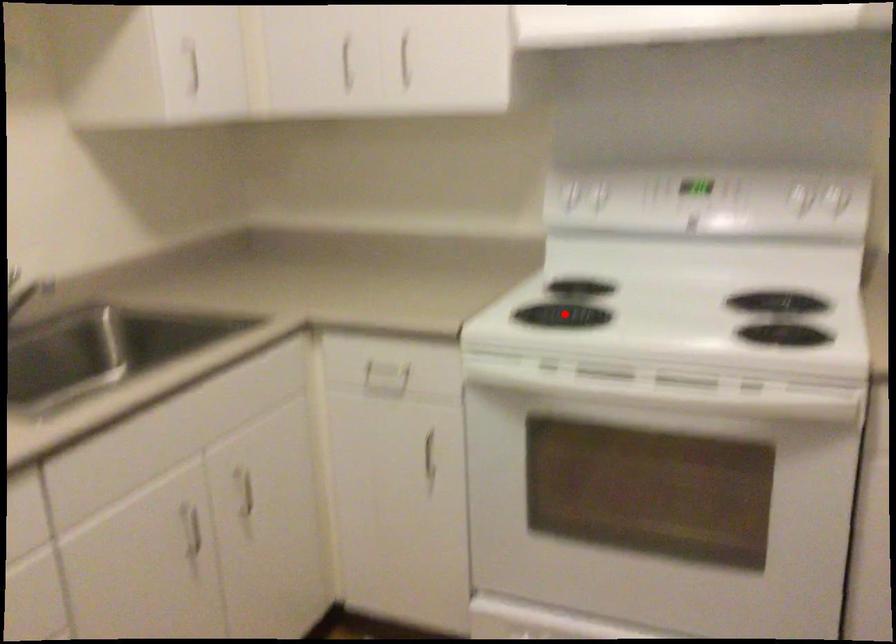
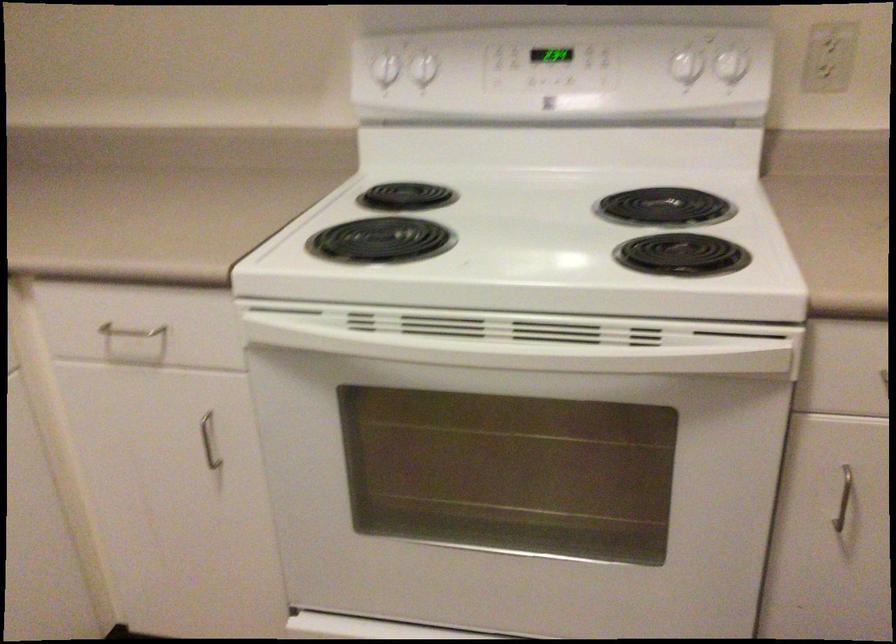
Locate, in the second image, the point that corresponds to the highlighted location in the first image.

(380, 240)